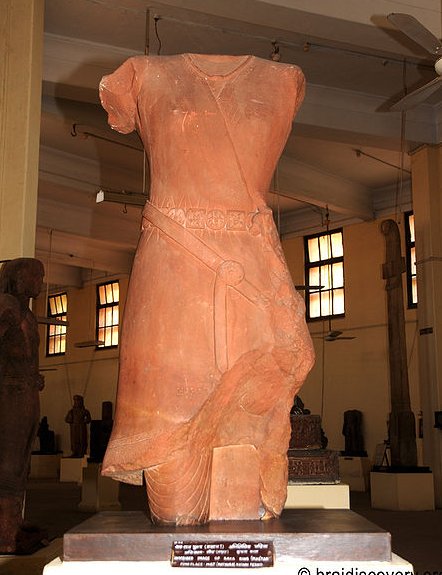
You are a GUI agent. You are given a task and a screenshot of the screen. Output one action in this format:
    pyautogui.click(x=<x>, y=<y>)
    Task: Click on the wall
    The width and height of the screenshot is (442, 575).
    Given the screenshot: What is the action you would take?
    pyautogui.click(x=360, y=386)